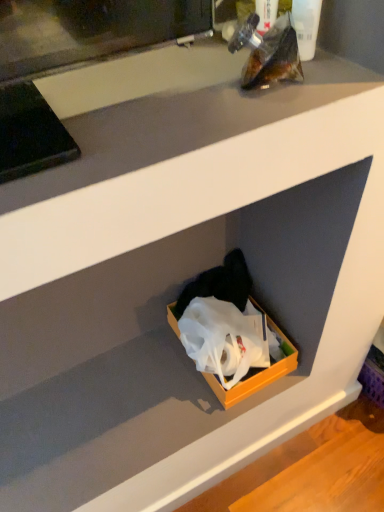
Locate an element on the screen. The width and height of the screenshot is (384, 512). orange matte box at lower center is located at coordinates (255, 375).

This screenshot has height=512, width=384. What do you see at coordinates (255, 375) in the screenshot?
I see `orange matte box at lower center` at bounding box center [255, 375].

Find the location of a particular element. The height and width of the screenshot is (512, 384). orange matte box at lower center is located at coordinates click(x=255, y=375).